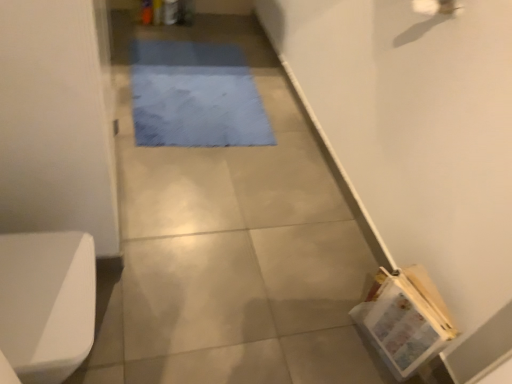
You are a GUI agent. You are given a task and a screenshot of the screen. Output one action in this format:
    pyautogui.click(x=<x>, y=<y>)
    Task: Click on the empty space that is ontop of white glossy toilet bowl at lower left (from a real-world perspective)
    
    Given the screenshot: What is the action you would take?
    pyautogui.click(x=40, y=276)